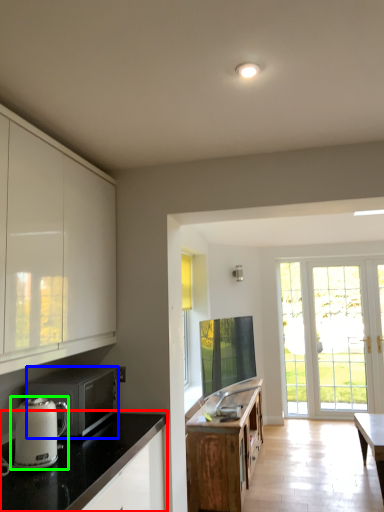
Question: Which object is the farthest from countertop (highlighted by a red box)? Choose among these: microwave oven (highlighted by a blue box) or kitchen appliance (highlighted by a green box).

Choices:
 (A) microwave oven
 (B) kitchen appliance

Answer: (A)